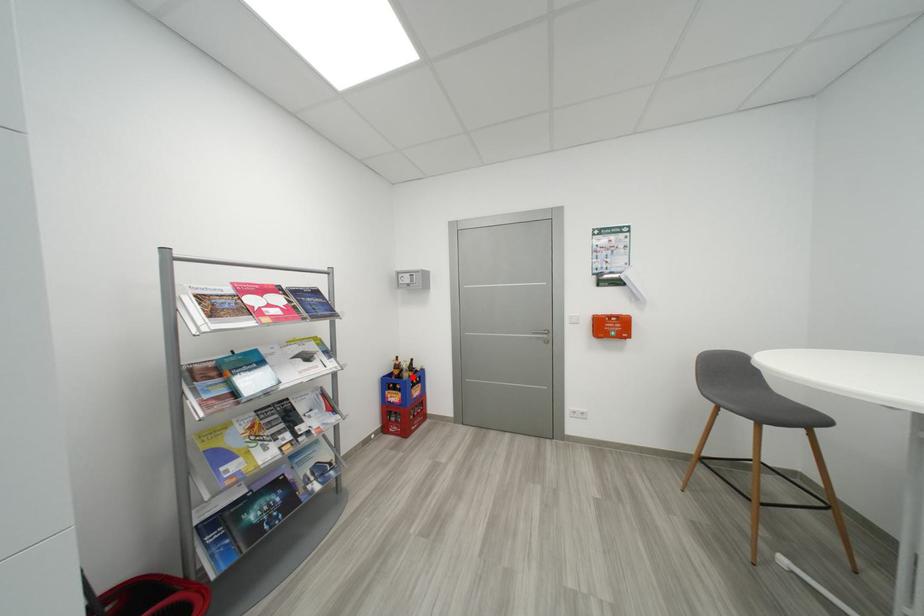
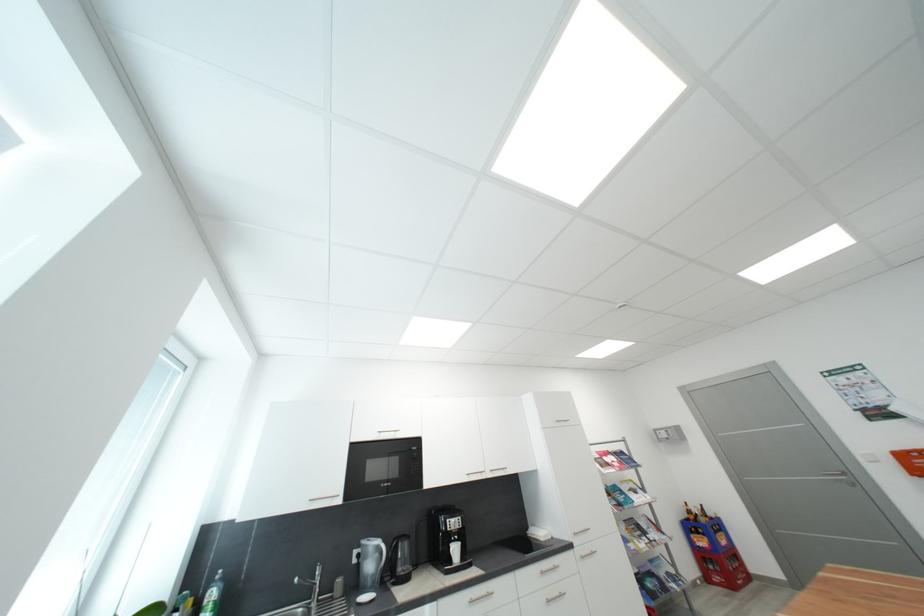
The point at the highlighted location is marked in the first image. Where is the corresponding point in the second image?

(710, 522)